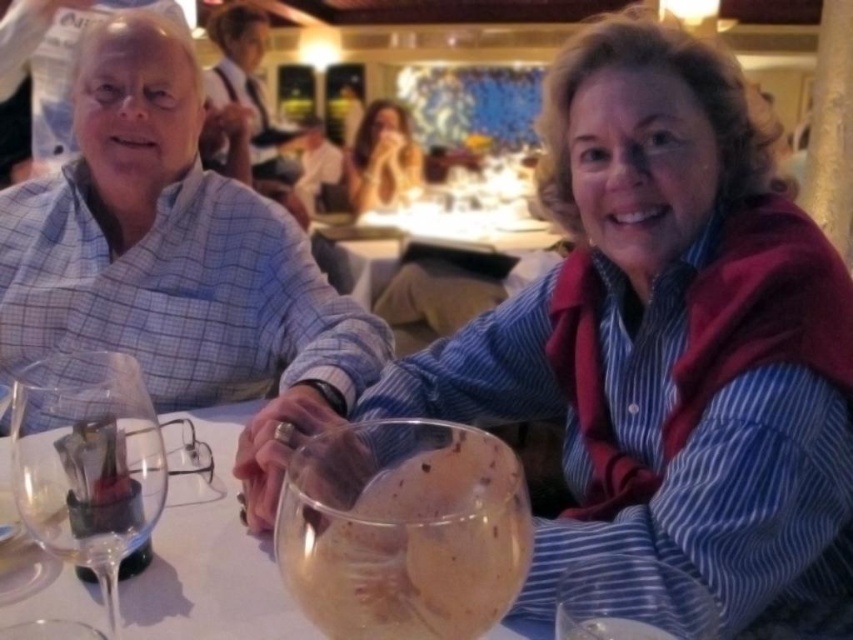
Can you confirm if blue striped shirt at center is positioned above clear glass wine glass at lower center?

Indeed, blue striped shirt at center is positioned over clear glass wine glass at lower center.

Where is `blue striped shirt at center`? The image size is (853, 640). blue striped shirt at center is located at coordinates (668, 337).

Which is more to the right, clear glass wine glass at lower left or blonde hair at upper center?

blonde hair at upper center is more to the right.

Is clear glass wine glass at lower left positioned in front of blonde hair at upper center?

Yes, clear glass wine glass at lower left is in front of blonde hair at upper center.

The image size is (853, 640). In order to click on clear glass wine glass at lower left in this screenshot , I will do `click(86, 461)`.

Who is shorter, blue striped shirt at center or clear glass bowl at center?

clear glass bowl at center

Is point (467, 412) closer to viewer compared to point (134, 618)?

No, (467, 412) is behind (134, 618).

In the scene shown: Who is more distant from viewer, (730, 620) or (207, 420)?

The point (207, 420) is more distant.

The image size is (853, 640). Identify the location of blue striped shirt at center. (668, 337).